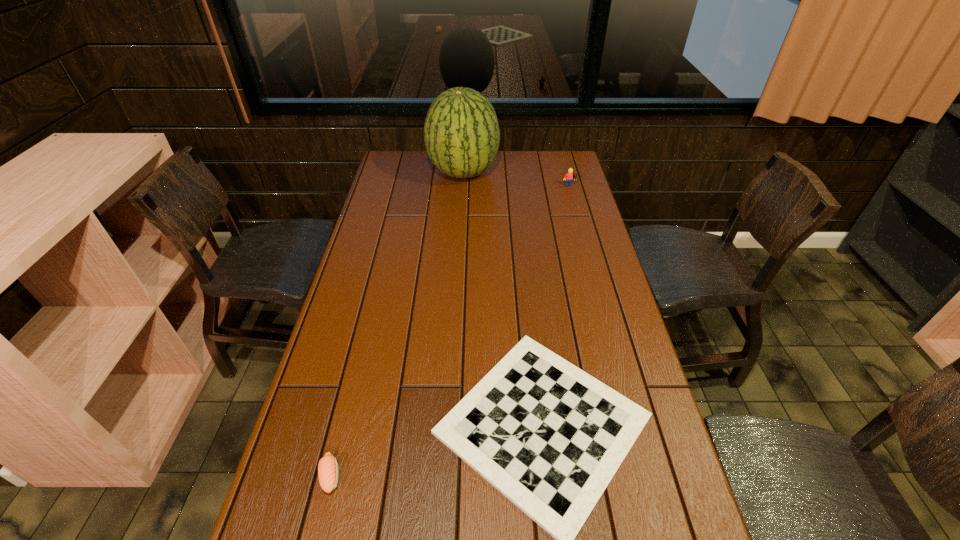
Identify the location of free space at the far edge of the desktop. Image resolution: width=960 pixels, height=540 pixels. (497, 171).

This screenshot has height=540, width=960. I want to click on free space at the left edge, so click(x=370, y=315).

Find the location of `free location at the right edge of the desktop`. free location at the right edge of the desktop is located at coordinates (589, 254).

Identify the location of free space at the far right corner of the desktop. (558, 169).

Where is `vacant point located between the third tallest object and the watermelon`? The height and width of the screenshot is (540, 960). vacant point located between the third tallest object and the watermelon is located at coordinates (397, 324).

Identify the location of unoccupied position between the second shortest object and the third shortest object. (450, 332).

I want to click on blank region between the watermelon and the Lego, so click(x=516, y=180).

Find the location of a particular element. empty space between the leftmost object and the tallest object is located at coordinates (397, 324).

The height and width of the screenshot is (540, 960). I want to click on vacant area that lies between the watermelon and the leftmost object, so click(x=397, y=324).

Locate which object is the closest to the second shortest object. Please provide its 2D coordinates. Your answer should be formatted as a tuple, i.e. [(x, y)], where the tuple contains the x and y coordinates of a point satisfying the conditions above.

[(550, 437)]